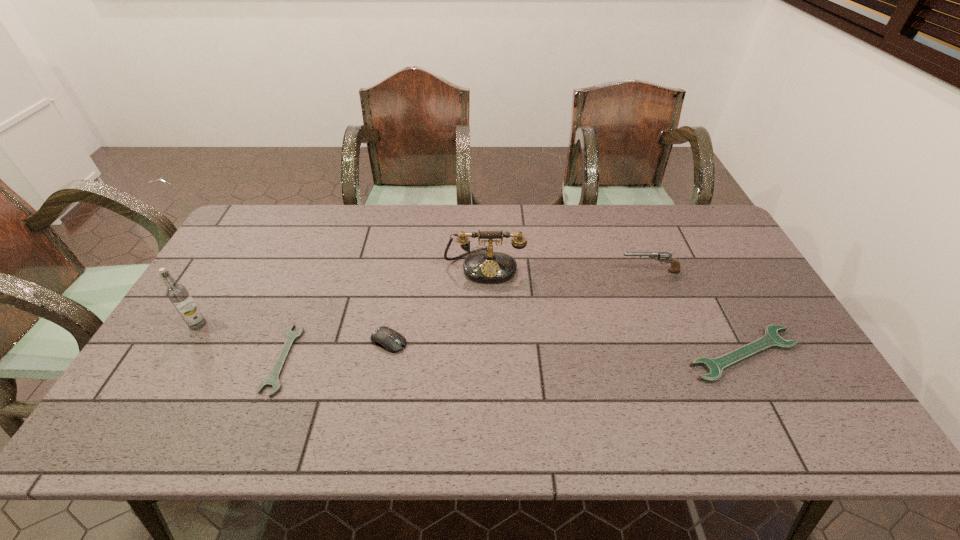
To achieve even spacing by inserting another wrench among them, please point to a vacant spot for this new wrench. Please provide its 2D coordinates. Your answer should be formatted as a tuple, i.e. [(x, y)], where the tuple contains the x and y coordinates of a point satisfying the conditions above.

[(515, 357)]